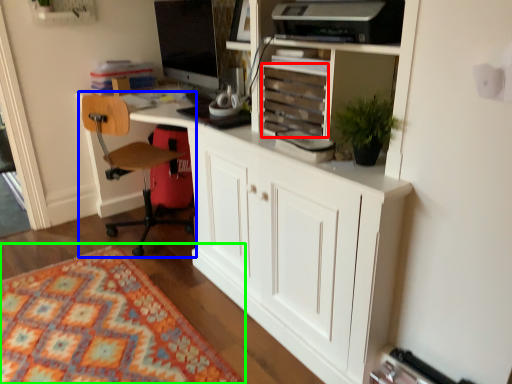
Question: Based on their relative distances, which object is nearer to drawer (highlighted by a red box)? Choose from chair (highlighted by a blue box) and mat (highlighted by a green box).

Choices:
 (A) chair
 (B) mat

Answer: (A)